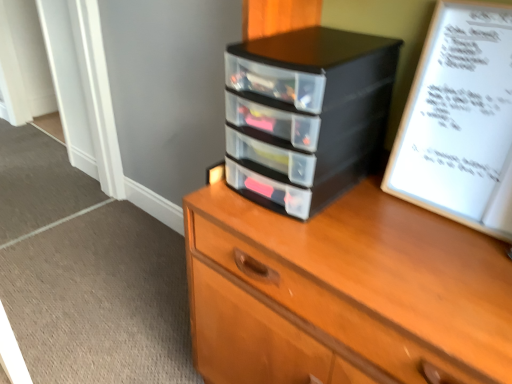
Question: Is black plastic drawers at center wider or thinner than white paper at upper right?

Choices:
 (A) thin
 (B) wide

Answer: (B)

Question: From their relative heights in the image, would you say black plastic drawers at center is taller or shorter than white paper at upper right?

Choices:
 (A) short
 (B) tall

Answer: (A)

Question: Based on their relative distances, which object is farther from the white paper at upper right?

Choices:
 (A) black plastic drawers at center
 (B) black plastic chest of drawers at center

Answer: (B)

Question: Which object is positioned closest to the white paper at upper right?

Choices:
 (A) black plastic chest of drawers at center
 (B) black plastic drawers at center

Answer: (B)